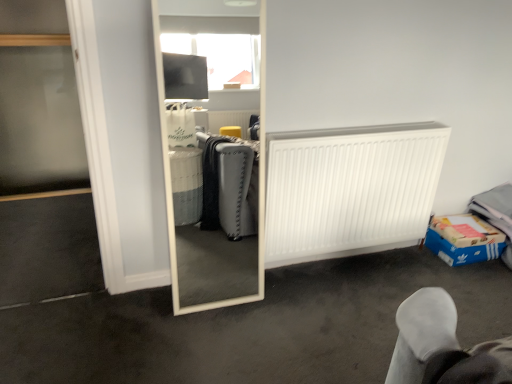
Question: Is white matte radiator at center right surrounding blue cardboard box at lower right?

Choices:
 (A) yes
 (B) no

Answer: (B)

Question: Is white matte radiator at center right not near blue cardboard box at lower right?

Choices:
 (A) no
 (B) yes

Answer: (A)

Question: Is white matte radiator at center right not within blue cardboard box at lower right?

Choices:
 (A) yes
 (B) no

Answer: (A)

Question: Is white matte radiator at center right thinner than blue cardboard box at lower right?

Choices:
 (A) yes
 (B) no

Answer: (A)

Question: From the image's perspective, does white matte radiator at center right appear lower than blue cardboard box at lower right?

Choices:
 (A) no
 (B) yes

Answer: (A)

Question: In the image, is blue cardboard box at lower right on the left side or the right side of white matte radiator at center right?

Choices:
 (A) right
 (B) left

Answer: (A)

Question: From their relative heights in the image, would you say blue cardboard box at lower right is taller or shorter than white matte radiator at center right?

Choices:
 (A) short
 (B) tall

Answer: (A)

Question: Is blue cardboard box at lower right bigger or smaller than white matte radiator at center right?

Choices:
 (A) big
 (B) small

Answer: (B)

Question: Does point (458, 223) appear closer or farther from the camera than point (347, 168)?

Choices:
 (A) farther
 (B) closer

Answer: (A)

Question: From their relative heights in the image, would you say blue cardboard box at lower right is taller or shorter than white matte mirror at center?

Choices:
 (A) tall
 (B) short

Answer: (A)

Question: From the image's perspective, is blue cardboard box at lower right positioned above or below white matte mirror at center?

Choices:
 (A) below
 (B) above

Answer: (B)

Question: Is blue cardboard box at lower right wider or thinner than white matte mirror at center?

Choices:
 (A) thin
 (B) wide

Answer: (A)

Question: Is blue cardboard box at lower right inside the boundaries of white matte mirror at center, or outside?

Choices:
 (A) inside
 (B) outside

Answer: (B)

Question: From the image's perspective, is white matte mirror at center above or below blue cardboard box at lower right?

Choices:
 (A) below
 (B) above

Answer: (A)

Question: From a real-world perspective, is white matte mirror at center above or below blue cardboard box at lower right?

Choices:
 (A) above
 (B) below

Answer: (B)